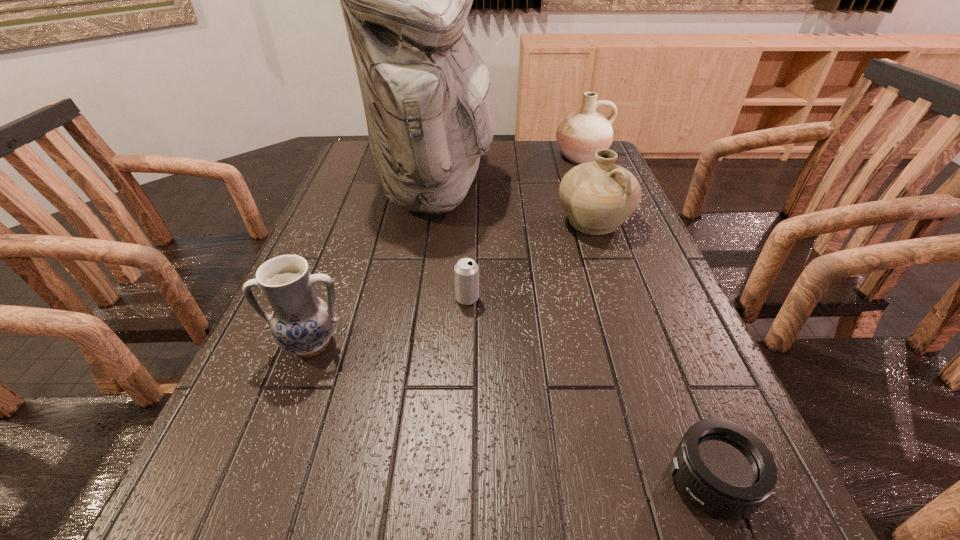
Locate an element on the screen. The height and width of the screenshot is (540, 960). the fifth closest object to the second farthest pottery is located at coordinates (723, 469).

Locate an element on the screen. This screenshot has height=540, width=960. object that ranks as the third closest to the farthest pottery is located at coordinates (466, 271).

This screenshot has width=960, height=540. I want to click on pottery that is the closest to the nearest pottery, so click(x=597, y=197).

This screenshot has height=540, width=960. In order to click on the closest pottery relative to the shortest object in this screenshot , I will do `click(597, 197)`.

At what (x,y) coordinates should I click in order to perform the action: click on vacant space that satisfies the following two spatial constraints: 1. on the front-facing side of the tallest object; 2. on the right side of the fifth tallest object. Please return your answer as a coordinate pair (x, y). Looking at the image, I should click on (421, 299).

The image size is (960, 540). What are the coordinates of `vacant space that satisfies the following two spatial constraints: 1. on the front-facing side of the second farthest pottery; 2. on the left side of the backpack` in the screenshot? It's located at (432, 222).

Identify the location of free space in the image that satisfies the following two spatial constraints: 1. to pour from the handle of the farthest pottery; 2. on the front-facing side of the tallest object. Image resolution: width=960 pixels, height=540 pixels. (594, 190).

Locate an element on the screen. This screenshot has width=960, height=540. free spot that satisfies the following two spatial constraints: 1. on the front-facing side of the fifth tallest object; 2. on the right side of the backpack is located at coordinates (421, 299).

Find the location of a particular element. vacant space that satisfies the following two spatial constraints: 1. on the front-facing side of the backpack; 2. on the front side of the nearest pottery is located at coordinates (415, 344).